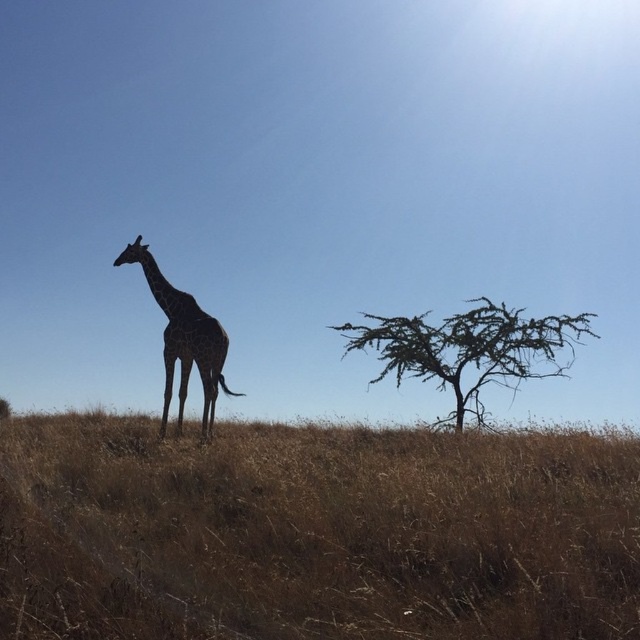
You are an animal tracker analyzing the savanna scene. You notice the dry grass at center. Based on its position, can you determine if it is closer to the giraffe or the right edge of the image?

The dry grass at center is located at point 0.833 on the horizontal axis. Since the giraffe is on the left side of the image and the right edge is at 1.0, the dry grass at center is closer to the right edge of the image.

You are a small rabbit hiding in the dry grass at center. Can you see the brown textured tree at right from your hiding spot? Please explain why or why not based on the scene.

The dry grass at center is shorter than the brown textured tree at right. Since the grass is shorter, the rabbit can see the tree above the grass.

Based on the photo, you are a photographer trying to capture the dry grass at center and the brown textured tree at right in a single shot. Based on their positions, which one would appear larger in your photo?

The dry grass at center appears larger in the photo because it is closer to the viewer than the brown textured tree at right.